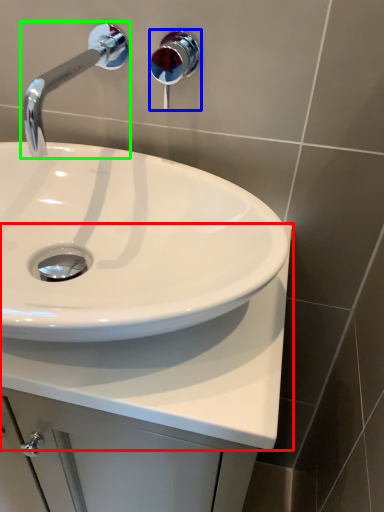
Question: Considering the real-world distances, which object is farthest from counter top (highlighted by a red box)? shower (highlighted by a blue box) or tap (highlighted by a green box)?

Choices:
 (A) shower
 (B) tap

Answer: (A)